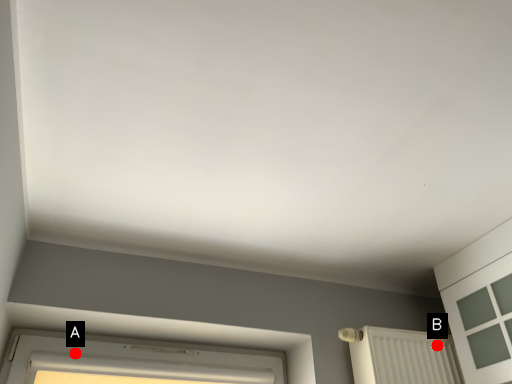
Question: Two points are circled on the image, labeled by A and B beside each circle. Which point is closer to the camera?

Choices:
 (A) A is closer
 (B) B is closer

Answer: (A)